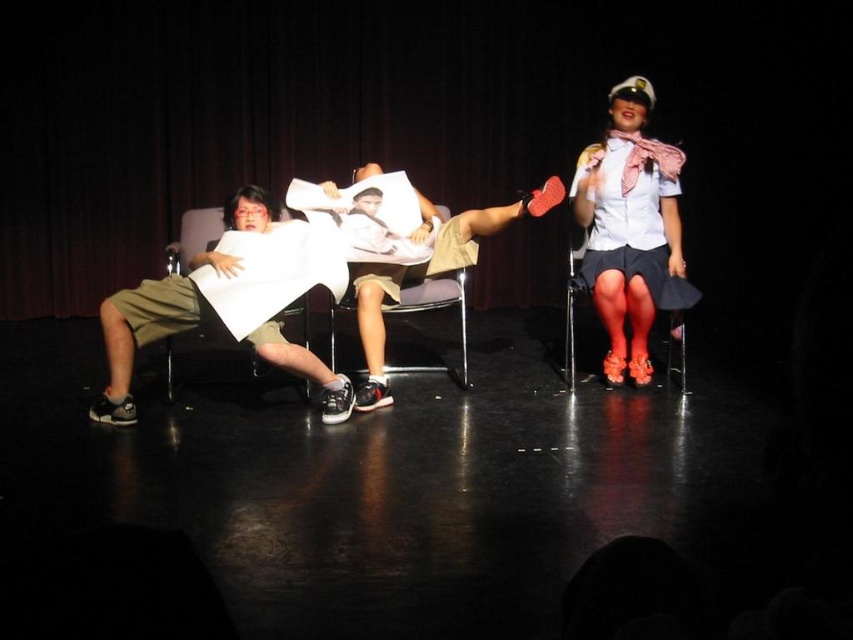
Between white glossy uniform at center and metallic silver chair at center, which one has less height?

metallic silver chair at center is shorter.

Between white glossy uniform at center and metallic silver chair at center, which one is positioned lower?

Positioned lower is metallic silver chair at center.

This screenshot has height=640, width=853. Describe the element at coordinates (630, 230) in the screenshot. I see `white glossy uniform at center` at that location.

In order to click on white glossy uniform at center in this screenshot , I will do `click(630, 230)`.

Describe the element at coordinates (630, 230) in the screenshot. The width and height of the screenshot is (853, 640). I see `white glossy uniform at center` at that location.

Is point (605, 170) closer to camera compared to point (160, 321)?

That is False.

Identify the location of white glossy uniform at center. The image size is (853, 640). (630, 230).

Locate an element on the screen. This screenshot has width=853, height=640. white glossy uniform at center is located at coordinates (630, 230).

Does matte khaki shorts at left have a larger size compared to khaki shorts at center?

Incorrect, matte khaki shorts at left is not larger than khaki shorts at center.

Is matte khaki shorts at left to the right of khaki shorts at center from the viewer's perspective?

Result: Incorrect, matte khaki shorts at left is not on the right side of khaki shorts at center.

Image resolution: width=853 pixels, height=640 pixels. What do you see at coordinates (141, 333) in the screenshot?
I see `matte khaki shorts at left` at bounding box center [141, 333].

Where is `matte khaki shorts at left`? matte khaki shorts at left is located at coordinates (141, 333).